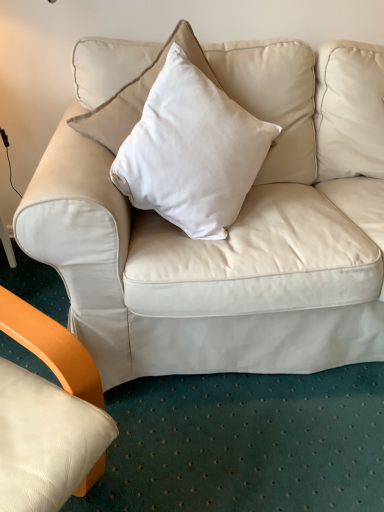
The height and width of the screenshot is (512, 384). What do you see at coordinates (209, 241) in the screenshot?
I see `matte white couch at center` at bounding box center [209, 241].

Locate an element on the screen. matte white couch at center is located at coordinates (209, 241).

Measure the distance between point [125,357] and camera.

The depth of point [125,357] is 3.92 feet.

This screenshot has width=384, height=512. What do you see at coordinates (191, 151) in the screenshot?
I see `white soft cushion at center` at bounding box center [191, 151].

I want to click on white soft cushion at center, so [x=191, y=151].

The image size is (384, 512). Identify the location of matte white couch at center. (209, 241).

Is white soft cushion at center to the left of matte white couch at center from the viewer's perspective?

Incorrect, white soft cushion at center is not on the left side of matte white couch at center.

Is white soft cushion at center closer to the viewer compared to matte white couch at center?

Yes, white soft cushion at center is in front of matte white couch at center.

Considering the positions of point (220, 125) and point (267, 339), is point (220, 125) closer or farther from the camera than point (267, 339)?

Point (220, 125) is closer to the camera than point (267, 339).

From the image's perspective, who appears lower, white soft cushion at center or matte white couch at center?

white soft cushion at center appears lower in the image.

From a real-world perspective, is white soft cushion at center physically located above or below matte white couch at center?

white soft cushion at center is above matte white couch at center.

Does white soft cushion at center have a lesser width compared to matte white couch at center?

Incorrect, the width of white soft cushion at center is not less than that of matte white couch at center.

In terms of height, does white soft cushion at center look taller or shorter compared to matte white couch at center?

white soft cushion at center is shorter than matte white couch at center.

Considering the sizes of white soft cushion at center and matte white couch at center in the image, is white soft cushion at center bigger or smaller than matte white couch at center?

Clearly, white soft cushion at center is smaller in size than matte white couch at center.

Is matte white couch at center a part of white soft cushion at center?

Yes, matte white couch at center can be found within white soft cushion at center.

Based on the photo, is white soft cushion at center directly adjacent to matte white couch at center?

No, white soft cushion at center is not with matte white couch at center.

Is white soft cushion at center oriented away from matte white couch at center?

Absolutely, white soft cushion at center is directed away from matte white couch at center.

How many degrees apart are the facing directions of white soft cushion at center and matte white couch at center?

The angle between the facing direction of white soft cushion at center and the facing direction of matte white couch at center is 6.23 degrees.

In order to click on studio couch to the left of white soft cushion at center in this screenshot , I will do `click(209, 241)`.

From the picture: Can you confirm if matte white couch at center is positioned to the left of white soft cushion at center?

Yes.

Which object is further away from the camera taking this photo, matte white couch at center or white soft cushion at center?

matte white couch at center.

Which is less distant, [278,211] or [195,183]?

The point [195,183] is in front.

From the image's perspective, which is below, matte white couch at center or white soft cushion at center?

white soft cushion at center appears lower in the image.

From a real-world perspective, who is located lower, matte white couch at center or white soft cushion at center?

In real-world perspective, matte white couch at center is lower.

Is matte white couch at center thinner than white soft cushion at center?

Yes.

Looking at this image, from their relative heights in the image, would you say matte white couch at center is taller or shorter than white soft cushion at center?

Clearly, matte white couch at center is taller compared to white soft cushion at center.

Which of these two, matte white couch at center or white soft cushion at center, is smaller?

white soft cushion at center.

Is matte white couch at center spatially inside white soft cushion at center, or outside of it?

matte white couch at center is enclosed within white soft cushion at center.

Is matte white couch at center far away from white soft cushion at center?

No.

Is matte white couch at center aimed at white soft cushion at center?

Yes.

Identify the location of pillow on the right of the matte white couch at center. (191, 151).

The height and width of the screenshot is (512, 384). What are the coordinates of `studio couch that is under the white soft cushion at center (from a real-world perspective)` in the screenshot? It's located at (209, 241).

At what (x,y) coordinates should I click in order to perform the action: click on studio couch on the left of white soft cushion at center. Please return your answer as a coordinate pair (x, y). Looking at the image, I should click on (209, 241).